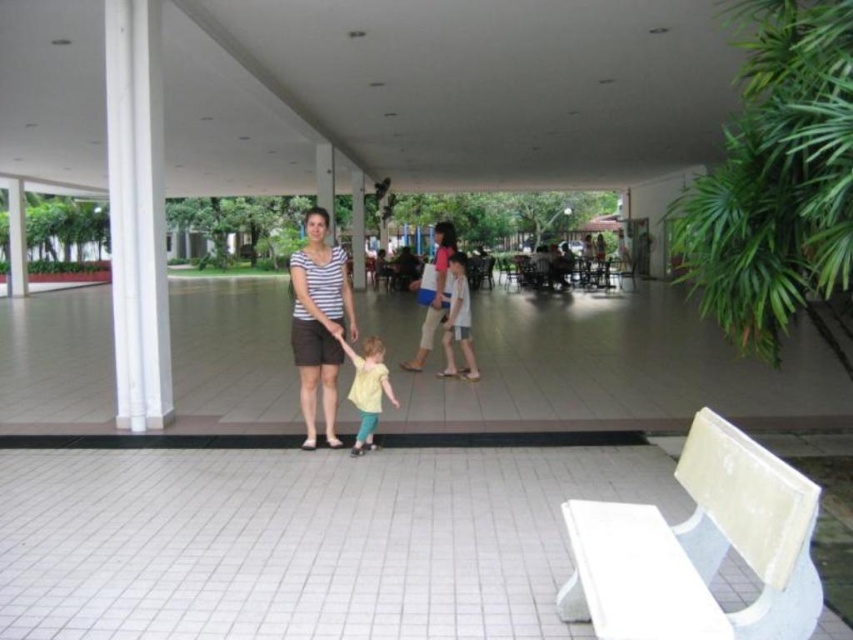
Between yellow matte shirt at center and light blue denim shorts at center, which one is positioned higher?

light blue denim shorts at center is higher up.

Is yellow matte shirt at center closer to camera compared to light blue denim shorts at center?

Yes, it is in front of light blue denim shorts at center.

Who is more distant from viewer, (375,356) or (469,340)?

The point (469,340) is more distant.

Where is `yellow matte shirt at center`? The height and width of the screenshot is (640, 853). yellow matte shirt at center is located at coordinates (367, 388).

Is point (320, 289) more distant than point (421, 355)?

No, (320, 289) is in front of (421, 355).

Between point (323, 392) and point (430, 285), which one is positioned behind?

Positioned behind is point (430, 285).

At what (x,y) coordinates should I click in order to perform the action: click on striped cotton shirt at center. Please return your answer as a coordinate pair (x, y). The width and height of the screenshot is (853, 640). Looking at the image, I should click on (318, 323).

Is striped cotton shirt at center closer to the viewer compared to light blue denim shorts at center?

Yes, striped cotton shirt at center is in front of light blue denim shorts at center.

Is striped cotton shirt at center further to the viewer compared to light blue denim shorts at center?

No, striped cotton shirt at center is in front of light blue denim shorts at center.

Identify the location of striped cotton shirt at center. (318, 323).

Identify the location of striped cotton shirt at center. This screenshot has width=853, height=640. (318, 323).